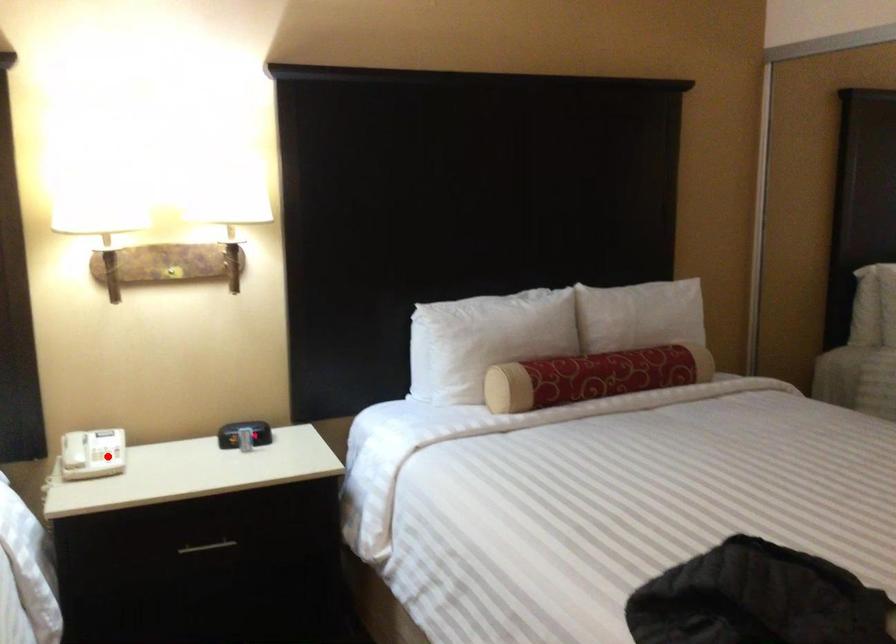
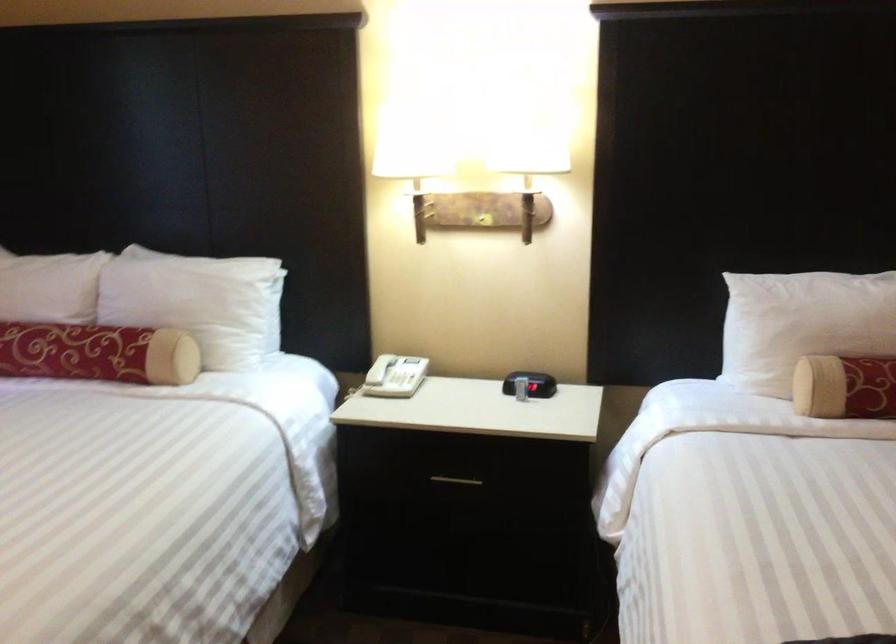
Where in the second image is the point corresponding to the highlighted location from the first image?

(405, 380)